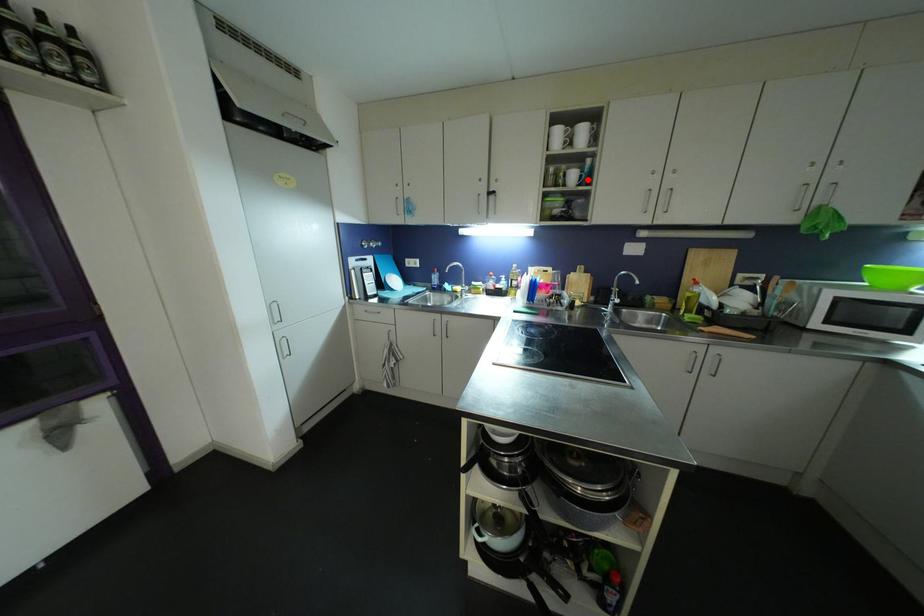
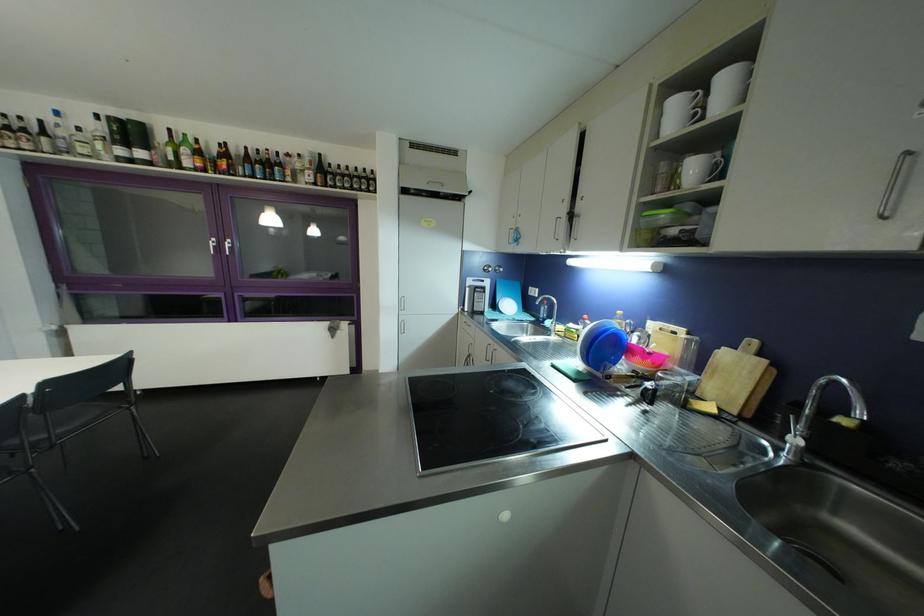
Locate, in the second image, the point that corresponds to the highlighted location in the first image.

(722, 169)